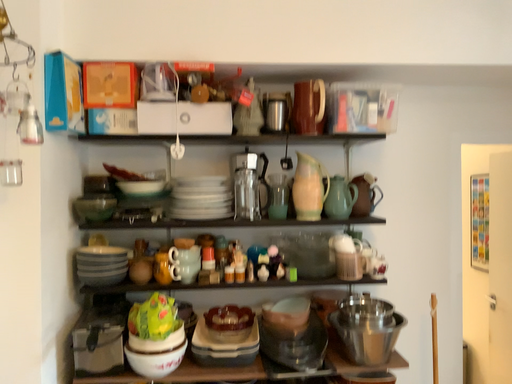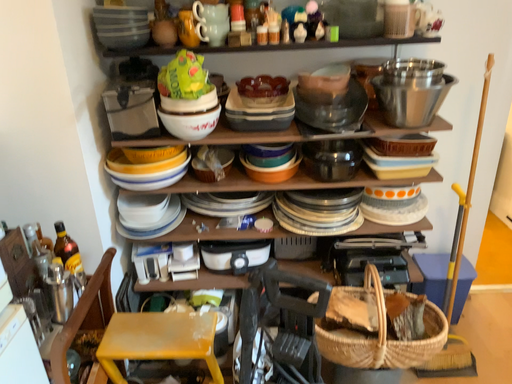
Question: How did the camera likely rotate when shooting the video?

Choices:
 (A) rotated upward
 (B) rotated downward

Answer: (B)